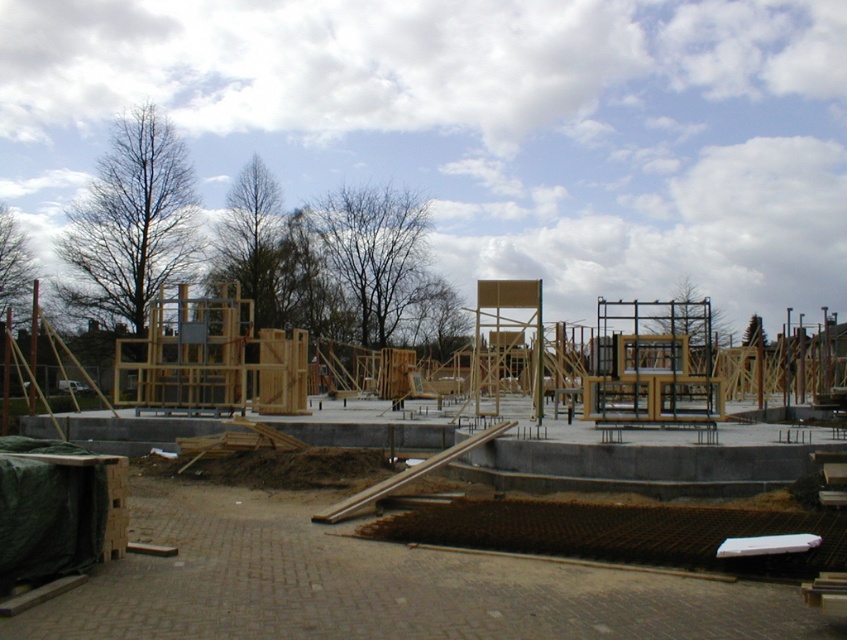
You are a construction worker standing at the edge of the construction site. You see two points marked on the ground at coordinates point [112,490] and point [211,422]. Which point is closer to your current position?

Point [112,490] is closer to the camera than point [211,422], so the point at [112,490] is closer to your current position.

You are a construction inspector checking the site layout. You notice the natural wood construction at center and the gray concrete foundation at center. According to the site plan, the wood structure should be elevated on top of the foundation. Does the current placement align with the requirements?

Yes, the natural wood construction at center is located above the gray concrete foundation at center, which matches the requirement for the wood structure to be elevated on top of the foundation.

You are an architect inspecting a construction site. You notice the natural wood construction at center and the gray concrete foundation at center. Which structure is taller?

The natural wood construction at center is shorter than the gray concrete foundation at center, so the gray concrete foundation at center is taller.